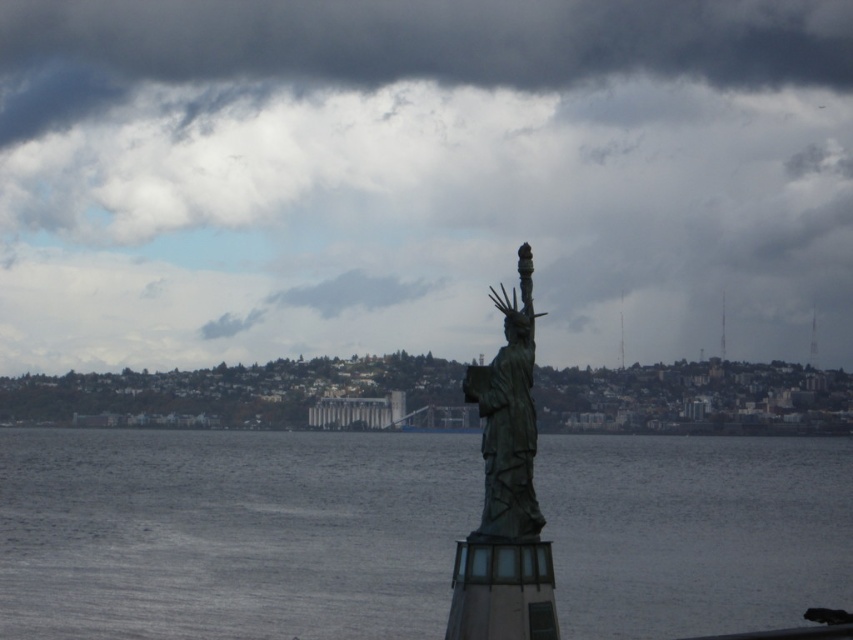
Is gray metallic water at center further to camera compared to bronze statue at center?

Yes.

Who is positioned more to the right, gray metallic water at center or bronze statue at center?

bronze statue at center

What do you see at coordinates (230, 532) in the screenshot? I see `gray metallic water at center` at bounding box center [230, 532].

Locate an element on the screen. Image resolution: width=853 pixels, height=640 pixels. gray metallic water at center is located at coordinates (230, 532).

Is cloudy sky at upper center behind bronze statue at center?

That is True.

Does cloudy sky at upper center have a lesser height compared to bronze statue at center?

In fact, cloudy sky at upper center may be taller than bronze statue at center.

Identify the location of cloudy sky at upper center. (421, 179).

Between point (375, 96) and point (299, 541), which one is positioned in front?

Point (299, 541) is in front.

Can you confirm if cloudy sky at upper center is shorter than gray metallic water at center?

Incorrect, cloudy sky at upper center's height does not fall short of gray metallic water at center's.

Is point (202, 164) in front of point (425, 468)?

No.

Find the location of a particular element. cloudy sky at upper center is located at coordinates (421, 179).